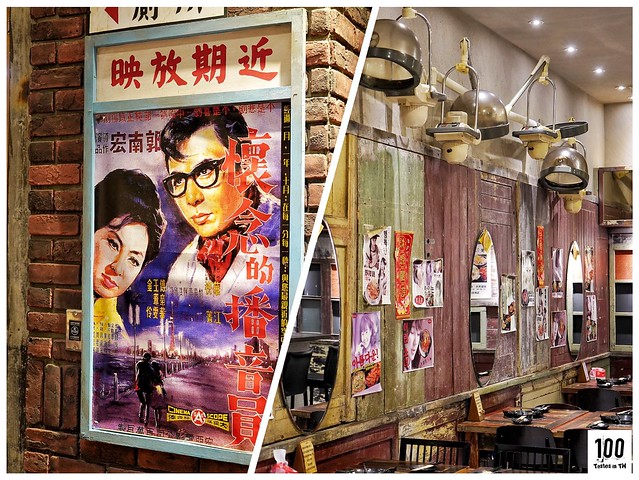
Locate an element on the screen. 3 oval mirrors is located at coordinates (484, 318), (308, 337), (578, 316).